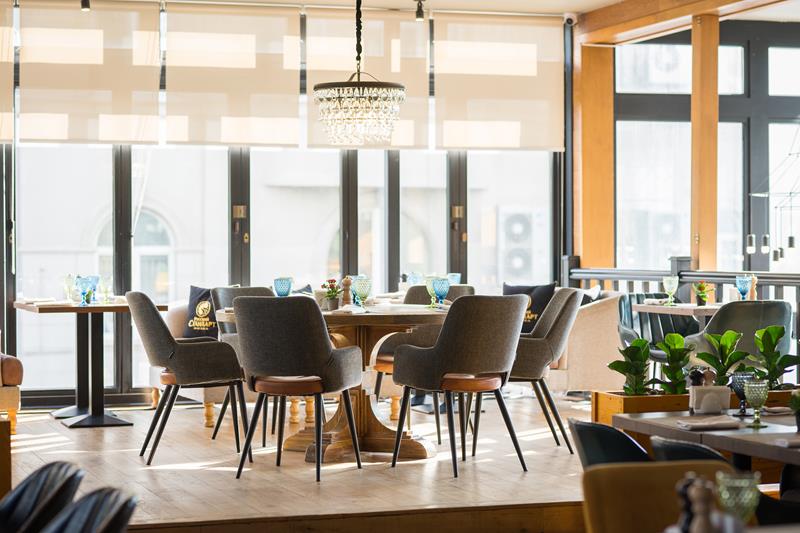
I want to click on tables, so click(397, 301), click(654, 301), click(592, 289), click(100, 311), click(714, 434).